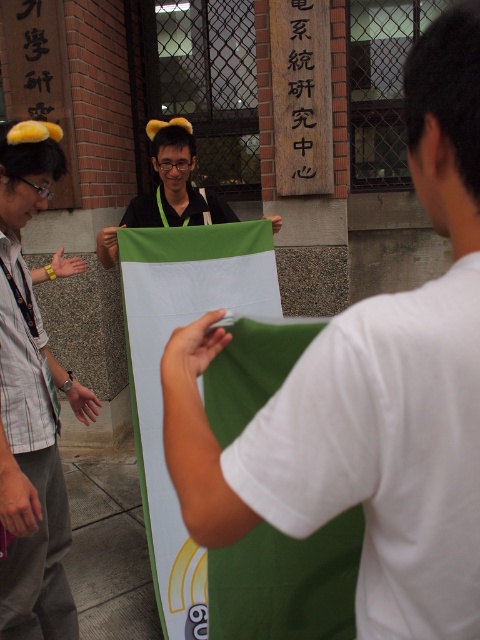
Question: Observing the image, what is the correct spatial positioning of green fabric at center in reference to matte green fabric at center?

Choices:
 (A) below
 (B) above

Answer: (B)

Question: Estimate the real-world distances between objects in this image. Which object is closer to the green fabric at center?

Choices:
 (A) green matte flag at center
 (B) matte green fabric at center

Answer: (B)

Question: Which point is farther to the camera?

Choices:
 (A) (407, 307)
 (B) (146, 218)

Answer: (B)

Question: Can you confirm if matte green fabric at center is positioned to the left of green matte flag at center?

Choices:
 (A) no
 (B) yes

Answer: (B)

Question: Is green fabric at center closer to the viewer compared to matte green fabric at center?

Choices:
 (A) yes
 (B) no

Answer: (A)

Question: Which of these objects is positioned closest to the green fabric at center?

Choices:
 (A) matte green fabric at center
 (B) green matte flag at center

Answer: (A)